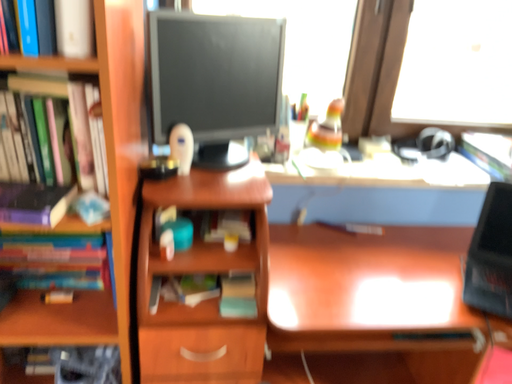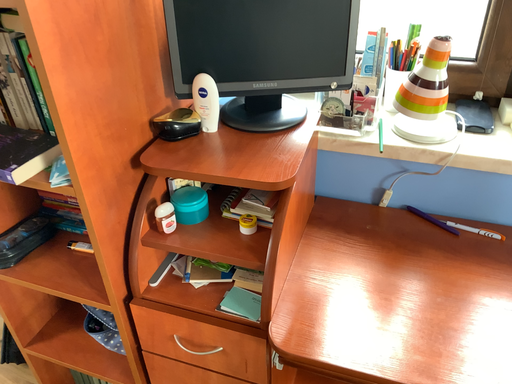
Question: Which way did the camera rotate in the video?

Choices:
 (A) rotated upward
 (B) rotated downward

Answer: (B)